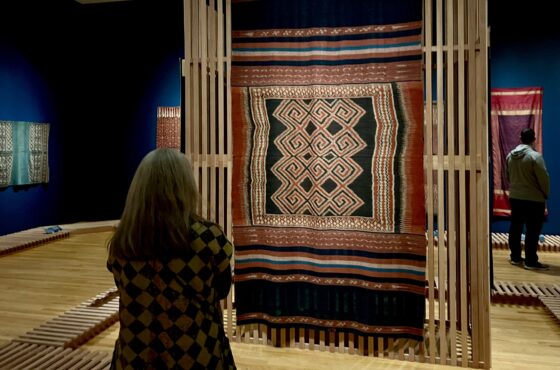
The height and width of the screenshot is (370, 560). What are the coordinates of `wooden structure` in the screenshot? It's located at (460, 81), (210, 100), (550, 304), (518, 290), (494, 237), (78, 317), (40, 357), (20, 235).